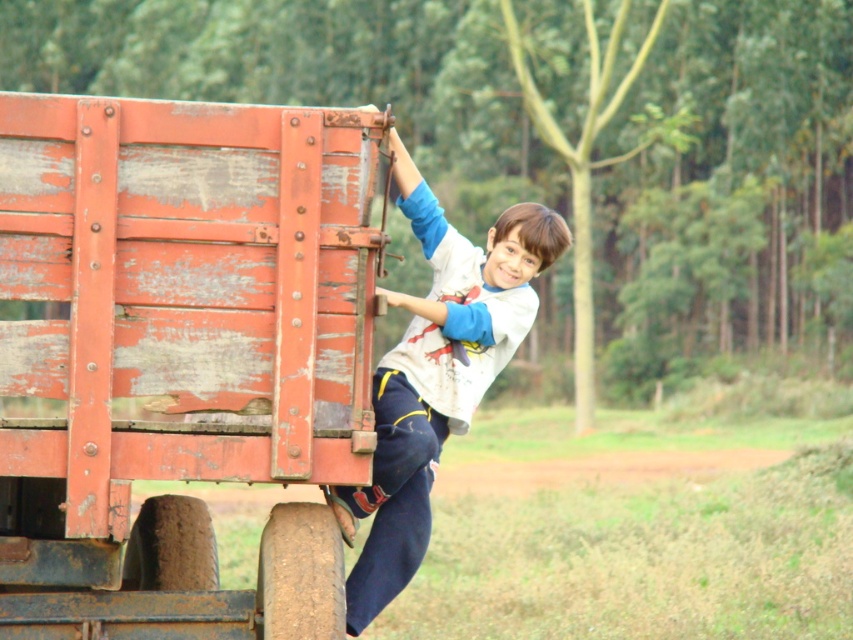
Does point (105, 154) come closer to viewer compared to point (502, 250)?

Yes, point (105, 154) is in front of point (502, 250).

Between rusty wood wagon at left and white cotton shirt at center, which one has less height?

white cotton shirt at center is shorter.

Between point (68, 266) and point (376, 410), which one is positioned behind?

Point (376, 410)

Locate an element on the screen. Image resolution: width=853 pixels, height=640 pixels. rusty wood wagon at left is located at coordinates (180, 356).